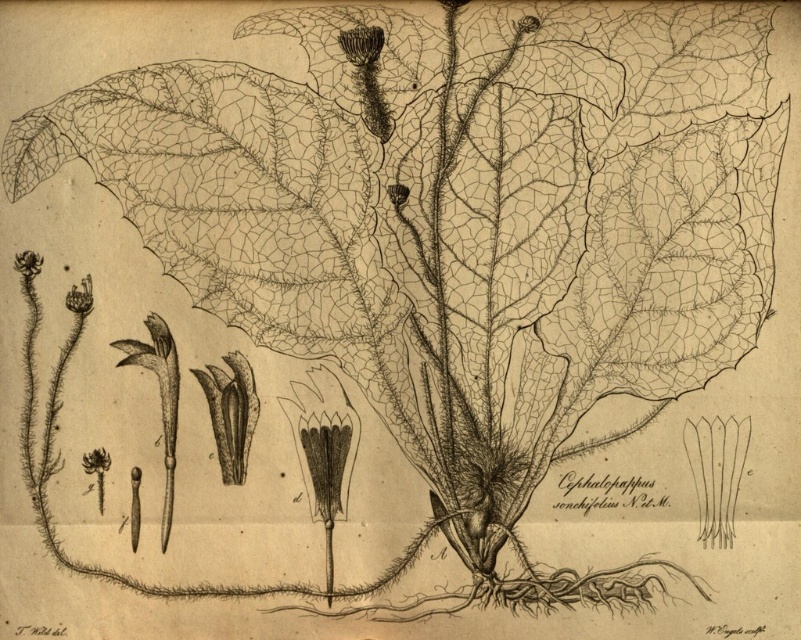
Can you confirm if matte black flower at upper left is positioned below white paper flower at upper left?

Yes, matte black flower at upper left is below white paper flower at upper left.

Who is more distant from viewer, (66, 301) or (34, 256)?

The point (66, 301) is more distant.

Is point (91, 276) behind point (35, 259)?

Yes, it is.

The image size is (801, 640). Identify the location of matte black flower at upper left. click(79, 298).